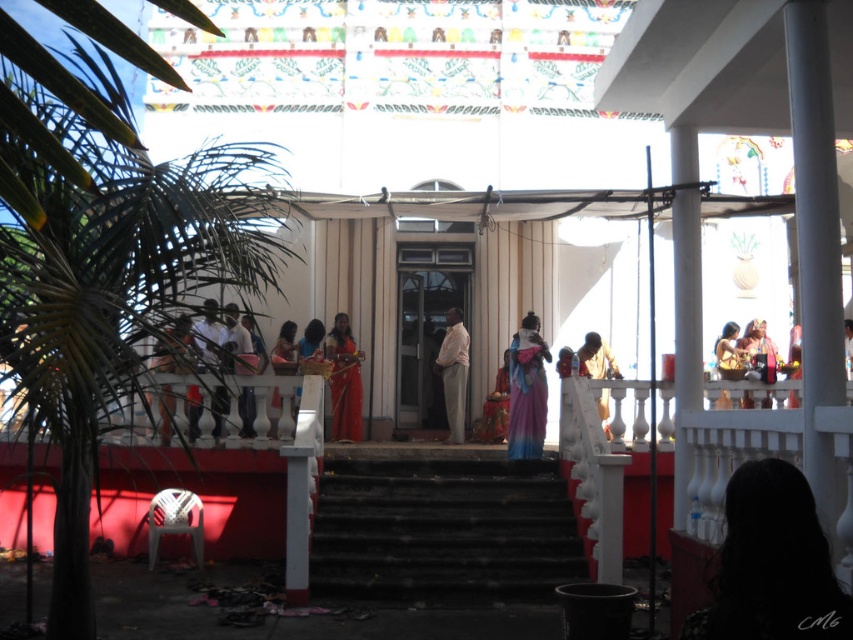
Consider the image. You are standing at the bottom of the black stone stairs at center and want to reach the matte pink saree at upper right. In which direction should you move relative to the stairs?

The matte pink saree at upper right is to the right of the black stone stairs at center, so you should move to the right relative to the stairs to reach it.

You are a visitor at the temple and want to take a photo of both the blue silk saree at center and the matte white statue at center. Since you want to ensure both are fully visible in the frame, which object should you focus on first to adjust your camera angle?

You should focus on the matte white statue at center first because it is taller than the blue silk saree at center, so adjusting the angle to accommodate its height will ensure the shorter saree is also captured.

You are a visitor at the temple and want to place your blue silk saree at center on top of the matte white statue at center. Will the saree fit on the statue?

The blue silk saree at center is thinner than the matte white statue at center, so it will fit on top of the statue since its width is narrower than the statue.